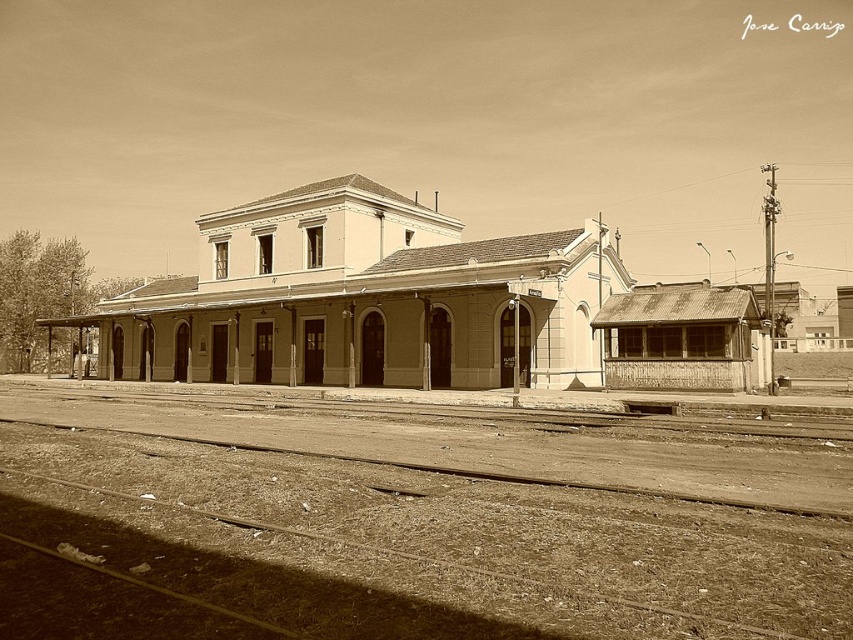
From the picture: You are a maintenance worker inspecting the tracks at the train station. You notice two tracks at the lower center of the scene. Which one is closer to you, the brown dirt track at lower center or the brown wooden train track at lower center?

The brown dirt track at lower center is closer to you because it is in front of the brown wooden train track at lower center.